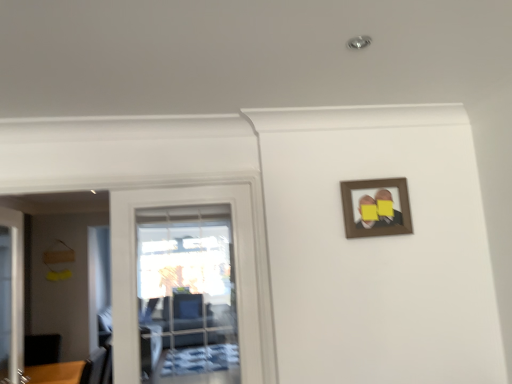
Question: From a real-world perspective, does transparent glass door at left, which appears as the first door when viewed from the right, stand above brown wooden picture frame at upper right?

Choices:
 (A) yes
 (B) no

Answer: (B)

Question: From a real-world perspective, is transparent glass door at left, which appears as the first door when viewed from the right, beneath brown wooden picture frame at upper right?

Choices:
 (A) no
 (B) yes

Answer: (B)

Question: Is brown wooden picture frame at upper right at the back of transparent glass door at left, which appears as the first door when viewed from the right?

Choices:
 (A) no
 (B) yes

Answer: (A)

Question: Considering the relative sizes of transparent glass door at left, which appears as the first door when viewed from the right, and brown wooden picture frame at upper right in the image provided, is transparent glass door at left, which appears as the first door when viewed from the right, shorter than brown wooden picture frame at upper right?

Choices:
 (A) no
 (B) yes

Answer: (A)

Question: Is the position of transparent glass door at left, which is counted as the 2th door, starting from the left, more distant than that of brown wooden picture frame at upper right?

Choices:
 (A) no
 (B) yes

Answer: (A)

Question: Can brown wooden picture frame at upper right be found inside transparent glass door at left, which appears as the first door when viewed from the right?

Choices:
 (A) no
 (B) yes

Answer: (A)

Question: Is brown wooden picture frame at upper right outside of transparent glass door at left, which appears as the first door when viewed from the right?

Choices:
 (A) no
 (B) yes

Answer: (B)

Question: Is brown wooden picture frame at upper right aimed at transparent glass door at left, which appears as the first door when viewed from the right?

Choices:
 (A) yes
 (B) no

Answer: (B)

Question: Does brown wooden picture frame at upper right have a lesser height compared to transparent glass door at left, which appears as the first door when viewed from the right?

Choices:
 (A) yes
 (B) no

Answer: (A)

Question: Is brown wooden picture frame at upper right to the right of transparent glass door at left, which appears as the first door when viewed from the right, from the viewer's perspective?

Choices:
 (A) no
 (B) yes

Answer: (B)

Question: Considering the relative sizes of brown wooden picture frame at upper right and transparent glass door at left, which is counted as the 2th door, starting from the left, in the image provided, is brown wooden picture frame at upper right wider than transparent glass door at left, which is counted as the 2th door, starting from the left,?

Choices:
 (A) no
 (B) yes

Answer: (A)

Question: Is the depth of brown wooden picture frame at upper right less than that of transparent glass door at left, which is counted as the 2th door, starting from the left?

Choices:
 (A) no
 (B) yes

Answer: (A)

Question: From a real-world perspective, is brown wooden picture frame at upper right located beneath white glossy door at left, which ranks as the first door in left-to-right order?

Choices:
 (A) yes
 (B) no

Answer: (B)